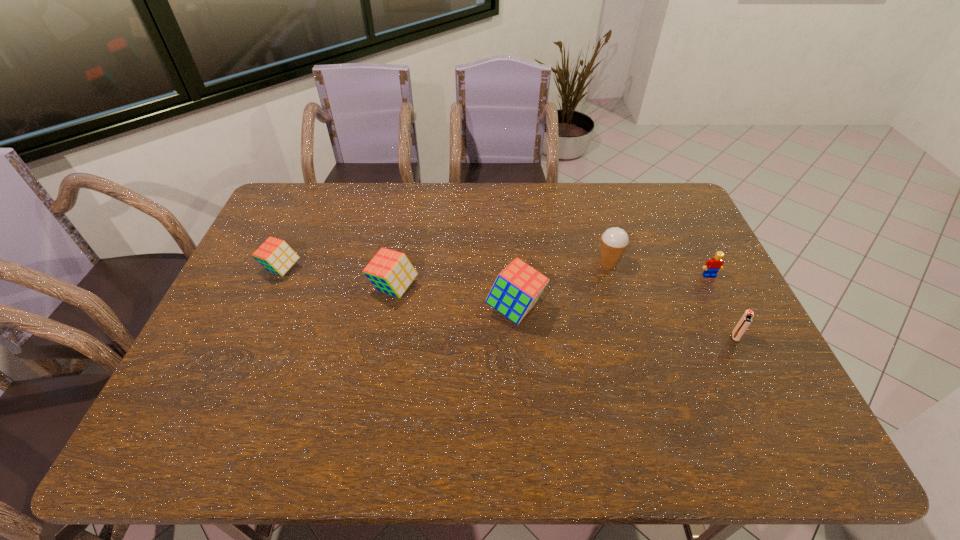
Where is `free space between the rightmost cube and the second tallest cube`? This screenshot has width=960, height=540. free space between the rightmost cube and the second tallest cube is located at coordinates (455, 298).

Locate which object ranks third in proximity to the nearest object. Please provide its 2D coordinates. Your answer should be formatted as a tuple, i.e. [(x, y)], where the tuple contains the x and y coordinates of a point satisfying the conditions above.

[(517, 288)]

Select which object appears as the fourth closest to the Lego. Please provide its 2D coordinates. Your answer should be formatted as a tuple, i.e. [(x, y)], where the tuple contains the x and y coordinates of a point satisfying the conditions above.

[(391, 272)]

This screenshot has height=540, width=960. I want to click on cube object that ranks as the second closest to the rightmost cube, so click(274, 254).

Select which cube appears as the closest to the rightmost cube. Please provide its 2D coordinates. Your answer should be formatted as a tuple, i.e. [(x, y)], where the tuple contains the x and y coordinates of a point satisfying the conditions above.

[(391, 272)]

Locate an element on the screen. Image resolution: width=960 pixels, height=540 pixels. free space that satisfies the following two spatial constraints: 1. on the back side of the second object from left to right; 2. on the right side of the icecream is located at coordinates (398, 264).

Image resolution: width=960 pixels, height=540 pixels. What are the coordinates of `vacant space that satisfies the following two spatial constraints: 1. on the front side of the leftmost object; 2. on the right side of the fourth object from right to left` in the screenshot? It's located at (265, 309).